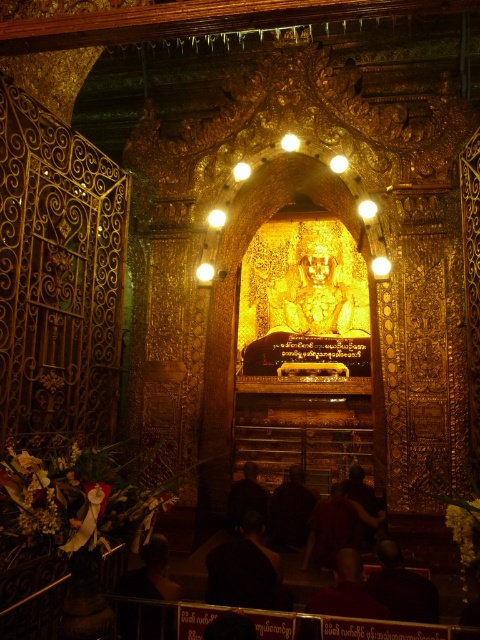
You are an architect designing a new temple and want to place a golden statue in the same location as the dark red fabric at center. What coordinates should you use?

The dark red fabric at center is positioned at coordinates point (336,525), so you should place the golden statue at point (336,525).